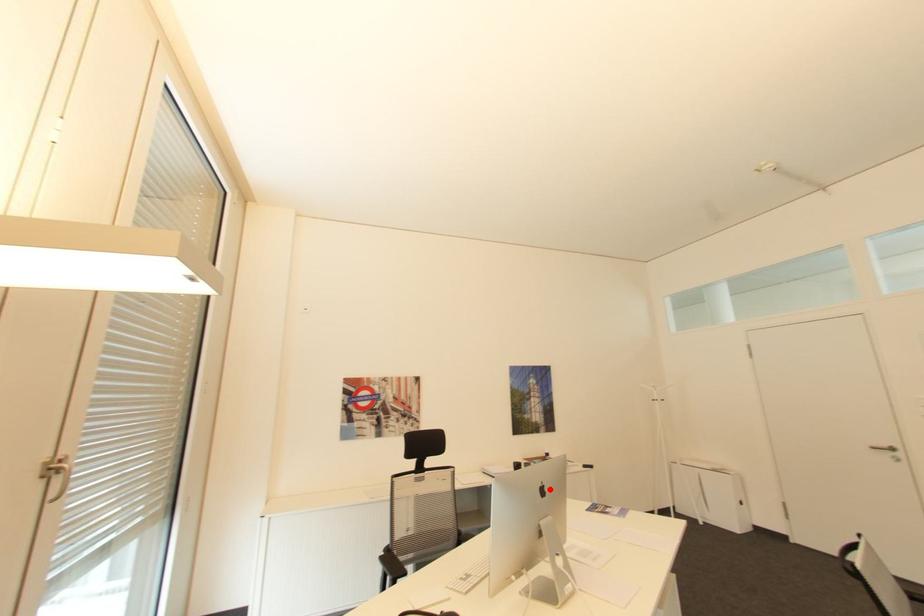
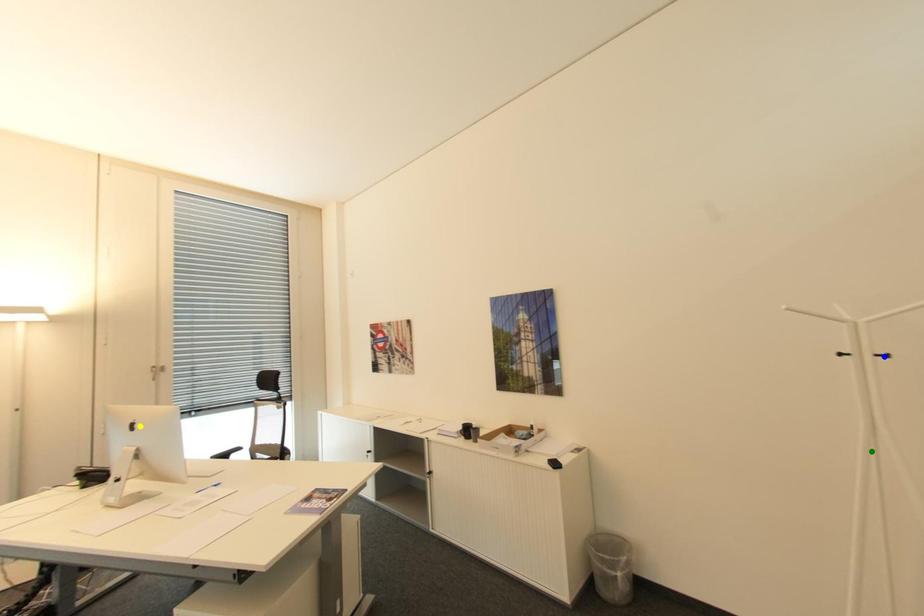
Question: I am providing you with two images of the same scene from different viewpoints. A red point is marked on the first image. You are given multiple points on the second image. Can you choose the point in image 2 that corresponds to the point in image 1?

Choices:
 (A) yellow point
 (B) green point
 (C) blue point

Answer: (A)